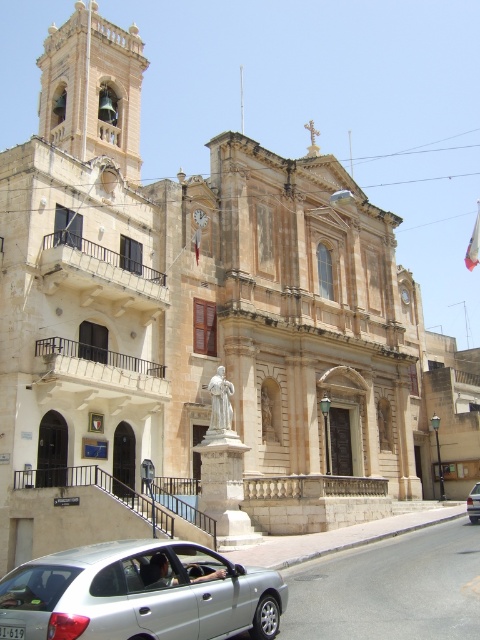
Does silver metallic hatchback at lower left come in front of silver metallic car at lower right?

Yes, it is.

Which is below, silver metallic hatchback at lower left or silver metallic car at lower right?

Positioned lower is silver metallic car at lower right.

Between point (95, 577) and point (477, 497), which one is positioned behind?

Point (477, 497)

Find the location of a particular element. The width and height of the screenshot is (480, 640). silver metallic hatchback at lower left is located at coordinates (140, 595).